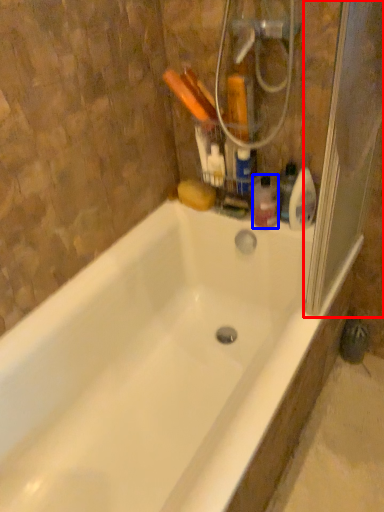
Question: Among these objects, which one is farthest to the camera, screen door (highlighted by a red box) or toiletry (highlighted by a blue box)?

Choices:
 (A) screen door
 (B) toiletry

Answer: (B)